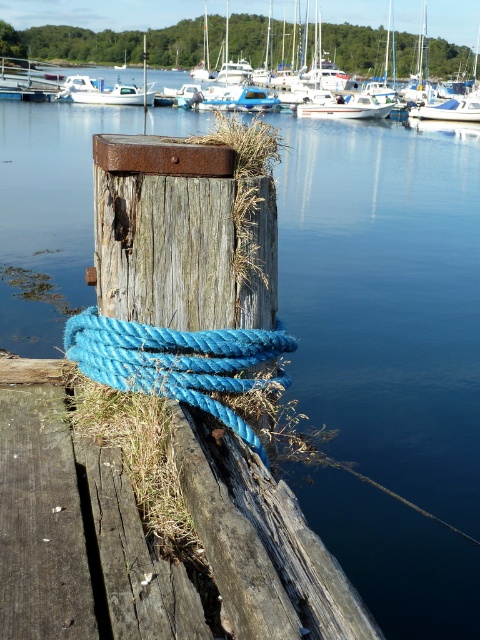
Question: Which of these objects is positioned closest to the weathered wood dock at lower left?

Choices:
 (A) white matte boat at upper left
 (B) blue rough rope at lower left
 (C) rustic wood post at center
 (D) white glossy boat at center

Answer: (B)

Question: Which object is farther from the camera taking this photo?

Choices:
 (A) white glossy boat at center
 (B) rustic wood post at center

Answer: (B)

Question: Does weathered wood dock at lower left lie behind rustic wood post at center?

Choices:
 (A) no
 (B) yes

Answer: (A)

Question: Which point is farther from the camera taking this photo?

Choices:
 (A) (346, 113)
 (B) (145, 212)

Answer: (A)

Question: Can you confirm if weathered wood dock at lower left is positioned below white glossy boat at center?

Choices:
 (A) no
 (B) yes

Answer: (B)

Question: In this image, where is rusty wood post at center located relative to blue rough rope at lower left?

Choices:
 (A) above
 (B) below

Answer: (A)